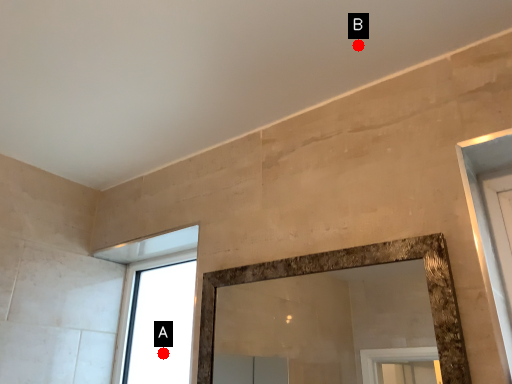
Question: Two points are circled on the image, labeled by A and B beside each circle. Which of the following is the farthest from the observer?

Choices:
 (A) A is further
 (B) B is further

Answer: (A)